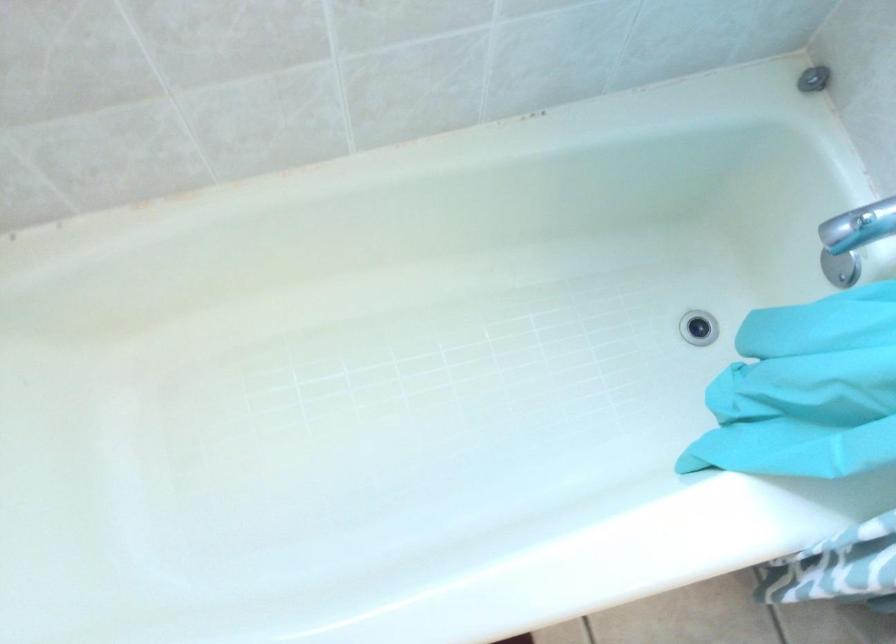
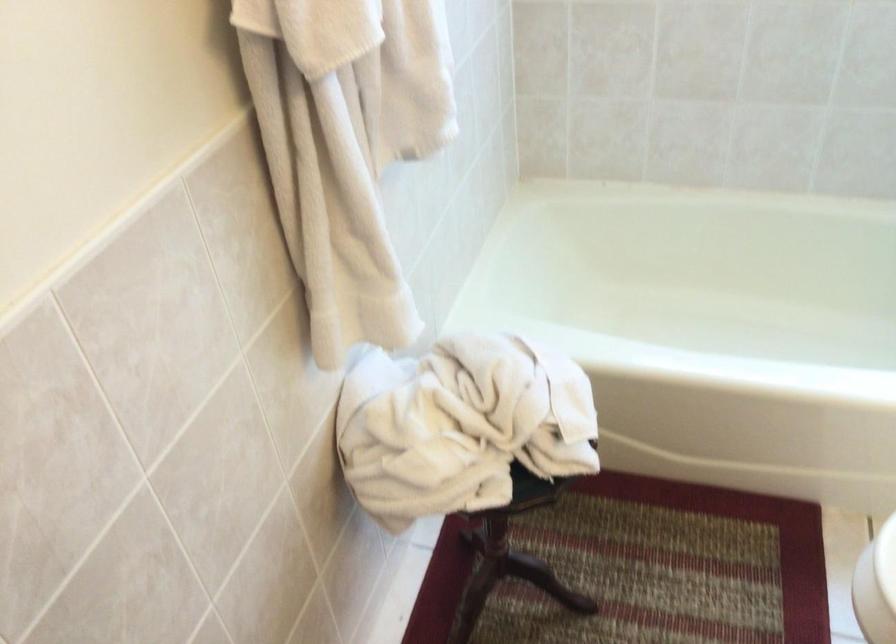
Locate, in the second image, the point that corresponds to [245,307] in the first image.

(698, 283)